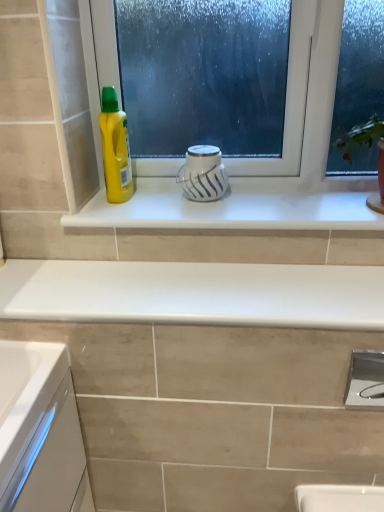
Locate an element on the screen. free space on the front side of yellow plastic bottle at left is located at coordinates (114, 214).